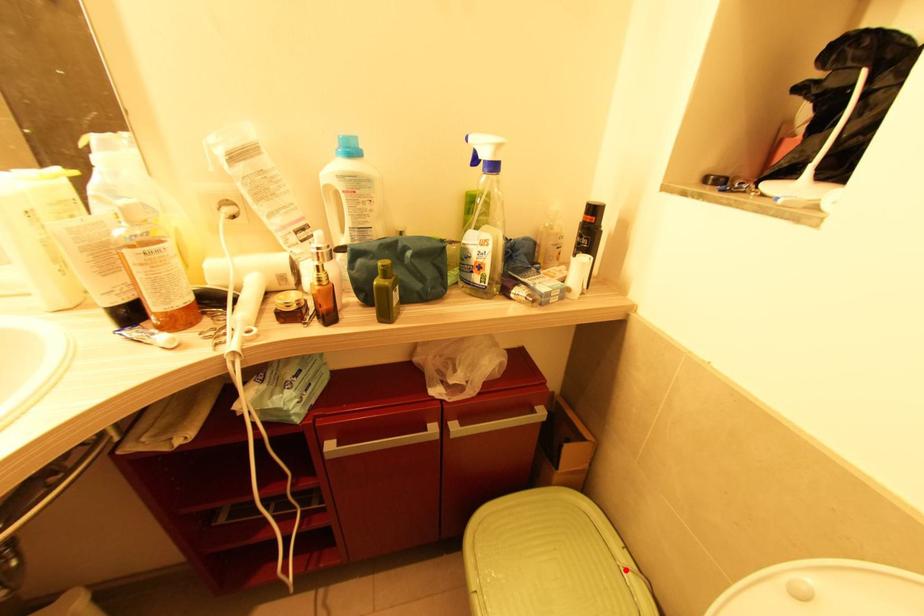
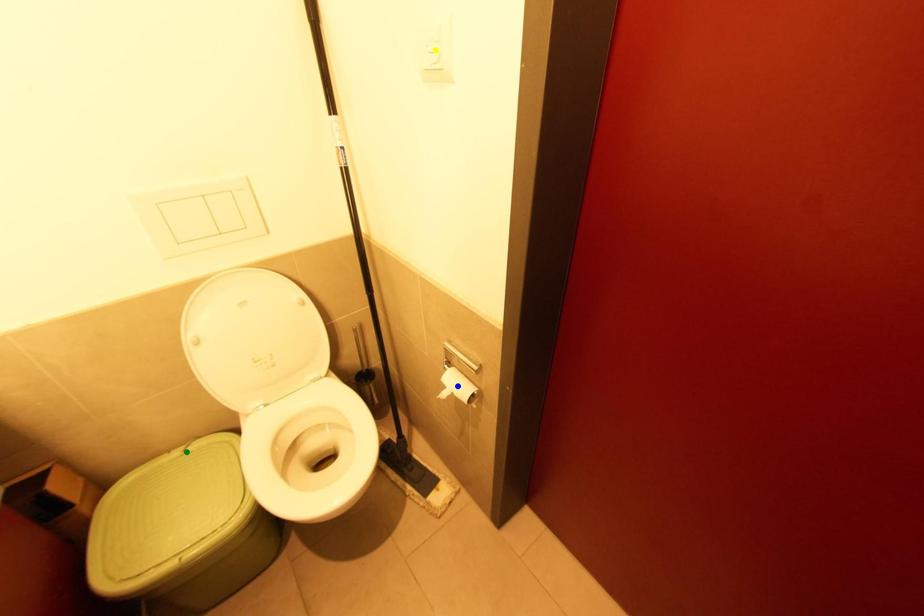
Question: I am providing you with two images of the same scene from different viewpoints. A red point is marked on the first image. You are given multiple points on the second image. In image 2, which mark is for the same physical point as the one in image 1?

Choices:
 (A) blue point
 (B) green point
 (C) yellow point

Answer: (B)